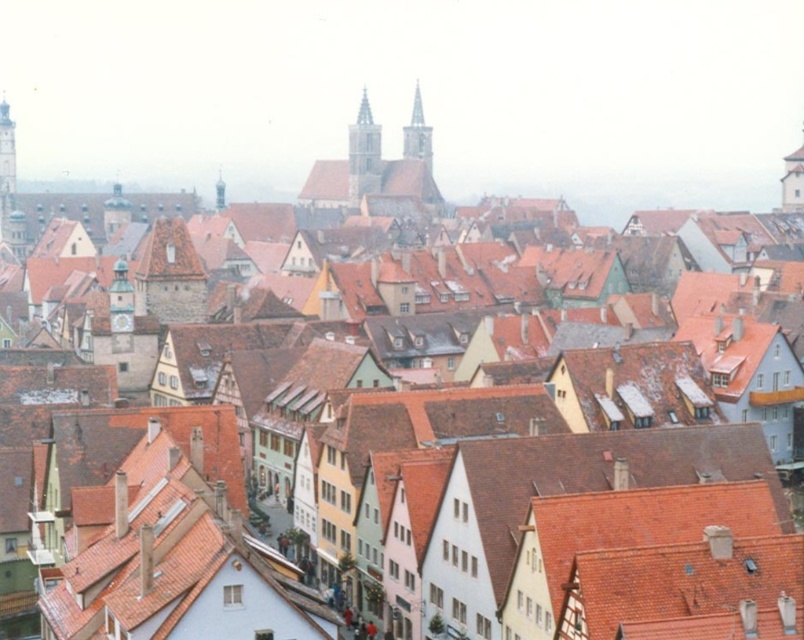
Question: Is smooth stone tower at left wider than smooth gray steeple at center?

Choices:
 (A) no
 (B) yes

Answer: (B)

Question: Which object is positioned closest to the smooth stone tower at center?

Choices:
 (A) smooth gray steeple at center
 (B) smooth stone tower at left

Answer: (A)

Question: Does smooth stone tower at center have a larger size compared to smooth stone tower at left?

Choices:
 (A) yes
 (B) no

Answer: (B)

Question: Which object is closer to the camera taking this photo?

Choices:
 (A) smooth gray steeple at center
 (B) smooth stone tower at center
 (C) smooth stone tower at left

Answer: (C)

Question: Which point is closer to the camera taking this photo?

Choices:
 (A) (368, 125)
 (B) (7, 115)

Answer: (B)

Question: Where is smooth stone tower at center located in relation to smooth gray steeple at center in the image?

Choices:
 (A) above
 (B) below

Answer: (B)